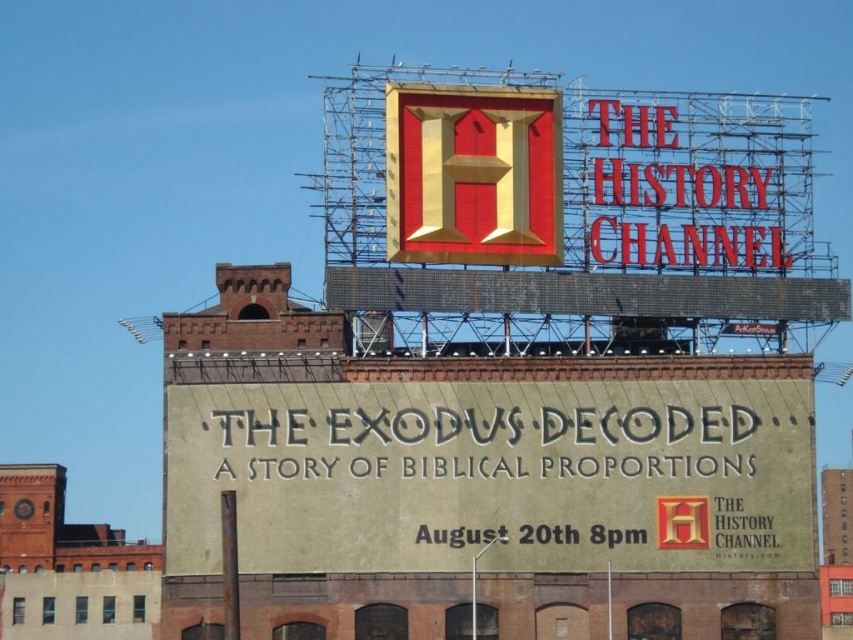
Based on the scene description, where is the beige textured billboard at center located in the image?

The beige textured billboard at center is located at point (492, 476).